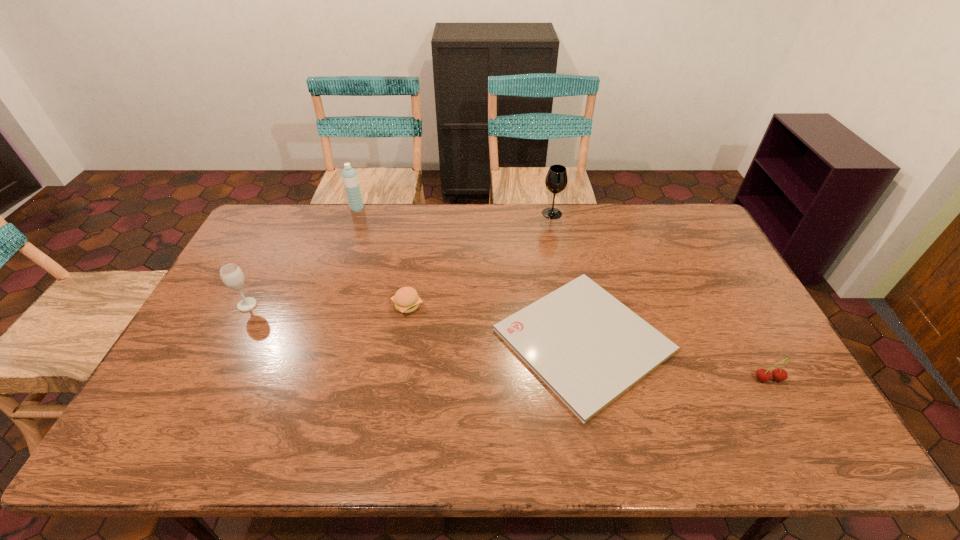
Identify the location of vacant space in between the water bottle and the third tallest object. This screenshot has width=960, height=540. (302, 257).

This screenshot has height=540, width=960. I want to click on free space between the leftmost object and the taller wineglass, so click(x=399, y=259).

I want to click on vacant area between the water bottle and the hamburger, so click(x=382, y=257).

Locate an element on the screen. unoccupied area between the rightmost object and the clipboard is located at coordinates (676, 360).

Identify which object is the third nearest to the hamburger. Please provide its 2D coordinates. Your answer should be formatted as a tuple, i.e. [(x, y)], where the tuple contains the x and y coordinates of a point satisfying the conditions above.

[(349, 175)]

Identify which object is the third nearest to the shorter wineglass. Please provide its 2D coordinates. Your answer should be formatted as a tuple, i.e. [(x, y)], where the tuple contains the x and y coordinates of a point satisfying the conditions above.

[(585, 345)]

Locate an element on the screen. free space that satisfies the following two spatial constraints: 1. on the back side of the left wineglass; 2. on the right side of the water bottle is located at coordinates (297, 209).